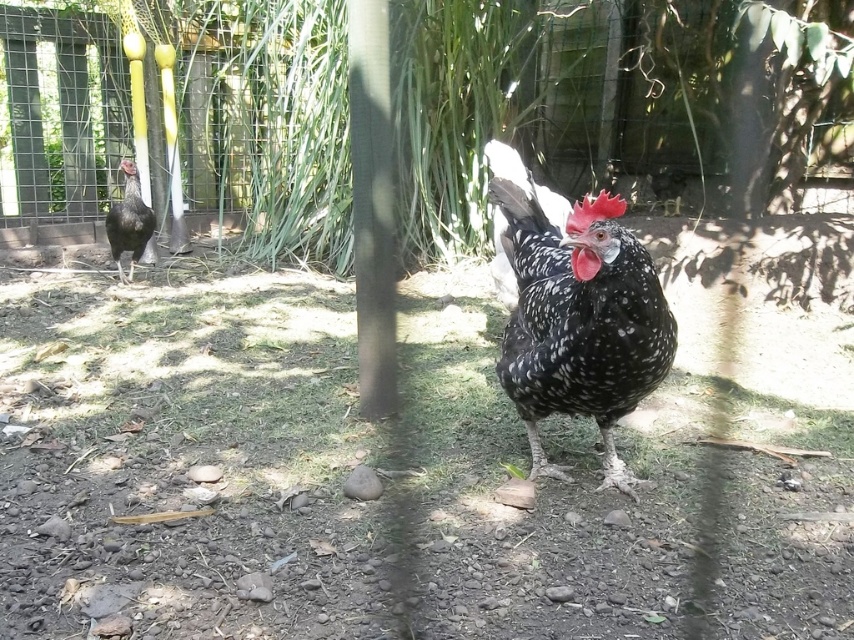
You are standing in a rural area and want to reach a specific point marked at coordinates point [451,244]. The terrain has uneven ground with small stones and dried leaves. Considering the distance from where you are standing, can you estimate whether you can comfortably walk to that point without needing to climb over any obstacles?

The distance of point [451,244] from viewer is 4.48 meters. Since the terrain has uneven ground with small stones and dried leaves but no mention of large obstacles, you can comfortably walk to that point without needing to climb over any obstacles.

From the picture: You are a farmer checking the chicken coop. You notice two chickens in the yard. Based on the scene, which chicken is wider between the speckled feathered chicken at center and the satin black chicken at left?

The speckled feathered chicken at center is wider than the satin black chicken at left.

You are a farmer checking on your chickens. You see the green leafy tree at center and the satin black chicken at left. Which object is positioned more to the right side of the scene?

The green leafy tree at center is positioned to the right of the satin black chicken at left, so the green leafy tree at center is more to the right side of the scene.